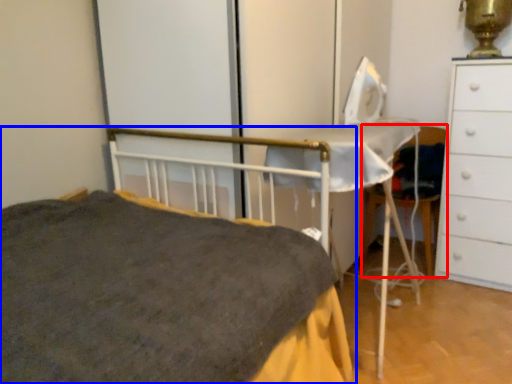
Question: Which object appears closest to the camera in this image, chair (highlighted by a red box) or bed (highlighted by a blue box)?

Choices:
 (A) chair
 (B) bed

Answer: (B)